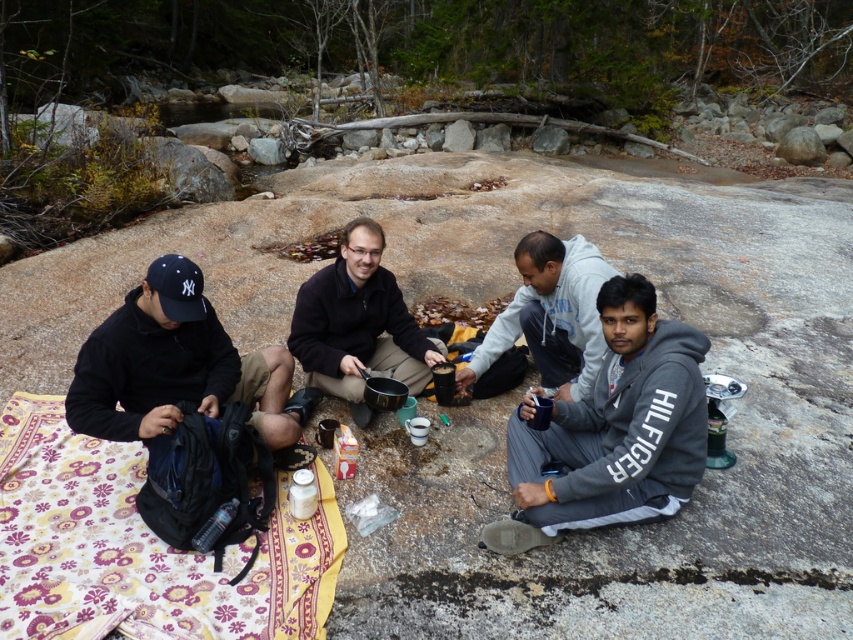
You are planning to set up a small picnic area near the stream. You have a patterned fabric blanket at lower left and a gray fleece jacket at lower right. Which item is closer to the stream if the stream is located on the left side of the scene?

The patterned fabric blanket at lower left is closer to the stream since it is positioned to the left of the gray fleece jacket at lower right, and the stream is on the left side of the scene.

You are a photographer standing at the camera position in the scene. You want to capture a closeup shot of the patterned fabric blanket at lower left without moving the blanket. Can you adjust your camera lens to zoom in enough to fill the frame with the blanket?

The patterned fabric blanket at lower left is 7.34 feet away from camera. To capture a closeup without moving the blanket, you would need a zoom lens capable of focusing on subjects at that distance while filling the frame. Standard lenses might struggle, but a telephoto lens with sufficient focal length could achieve this by magnifying the image sufficiently to make the blanket appear larger in the frame.

You are a photographer trying to capture a photo of the group. You notice the gray fleece jacket at lower right and the black matte jacket at lower left. Which jacket is positioned closer to the bottom of the image?

The gray fleece jacket at lower right is positioned closer to the bottom of the image because it is below the black matte jacket at lower left.